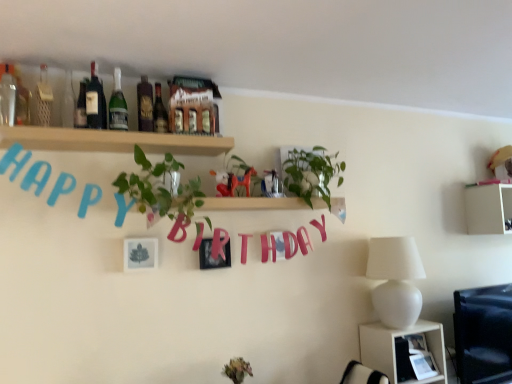
Question: Does green glass bottle at upper center, which is counted as the 5th bottle, starting from the left, have a greater height compared to matte red horse at center?

Choices:
 (A) yes
 (B) no

Answer: (A)

Question: Can matte red horse at center be found inside green glass bottle at upper center, which appears as the third bottle when viewed from the right?

Choices:
 (A) no
 (B) yes

Answer: (A)

Question: Is green glass bottle at upper center, which appears as the third bottle when viewed from the right, wider than matte red horse at center?

Choices:
 (A) no
 (B) yes

Answer: (A)

Question: From a real-world perspective, does green glass bottle at upper center, which is counted as the 5th bottle, starting from the left, sit lower than matte red horse at center?

Choices:
 (A) yes
 (B) no

Answer: (B)

Question: Is green glass bottle at upper center, which appears as the third bottle when viewed from the right, to the right of matte red horse at center from the viewer's perspective?

Choices:
 (A) yes
 (B) no

Answer: (B)

Question: Does green glass bottle at upper center, which is counted as the 5th bottle, starting from the left, have a smaller size compared to matte red horse at center?

Choices:
 (A) yes
 (B) no

Answer: (A)

Question: Considering the relative sizes of wooden shelf at upper center, which appears as the 1th shelf when viewed from the top, and matte glass bottle at upper center, arranged as the 6th bottle when viewed from the left, in the image provided, is wooden shelf at upper center, which appears as the 1th shelf when viewed from the top, smaller than matte glass bottle at upper center, arranged as the 6th bottle when viewed from the left,?

Choices:
 (A) no
 (B) yes

Answer: (A)

Question: Is wooden shelf at upper center, which appears as the 1th shelf when viewed from the top, thinner than matte glass bottle at upper center, arranged as the 6th bottle when viewed from the left?

Choices:
 (A) no
 (B) yes

Answer: (A)

Question: Does wooden shelf at upper center, the first shelf in the front-to-back sequence, contain matte glass bottle at upper center, placed as the second bottle when sorted from right to left?

Choices:
 (A) no
 (B) yes

Answer: (A)

Question: Considering the relative sizes of wooden shelf at upper center, the first shelf in the front-to-back sequence, and matte glass bottle at upper center, placed as the second bottle when sorted from right to left, in the image provided, is wooden shelf at upper center, the first shelf in the front-to-back sequence, bigger than matte glass bottle at upper center, placed as the second bottle when sorted from right to left,?

Choices:
 (A) yes
 (B) no

Answer: (A)

Question: Is wooden shelf at upper center, the first shelf in the front-to-back sequence, closer to the viewer compared to matte glass bottle at upper center, arranged as the 6th bottle when viewed from the left?

Choices:
 (A) yes
 (B) no

Answer: (A)

Question: Is wooden shelf at upper center, the first shelf in the front-to-back sequence, at the left side of matte glass bottle at upper center, arranged as the 6th bottle when viewed from the left?

Choices:
 (A) yes
 (B) no

Answer: (A)

Question: Is green glass bottle at upper center, which appears as the third bottle when viewed from the right, at the left side of white matte lamp at right?

Choices:
 (A) yes
 (B) no

Answer: (A)